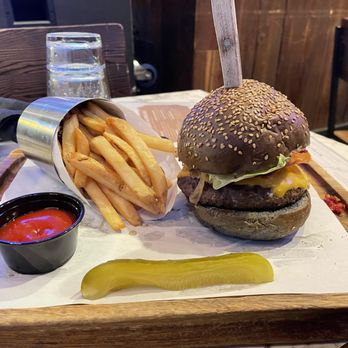
What are the coordinates of `small cup` in the screenshot? It's located at (60, 248).